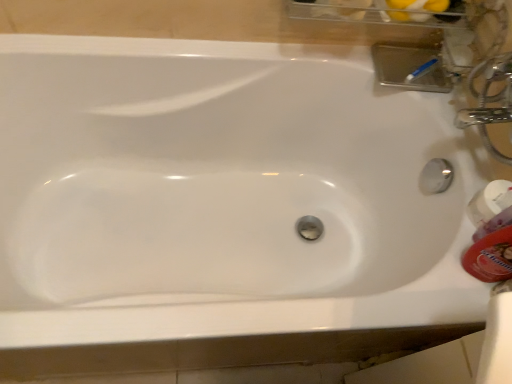
Where is `free space in front of white glossy mouthwash at right, the first mouthwash positioned from the back`? Image resolution: width=512 pixels, height=384 pixels. free space in front of white glossy mouthwash at right, the first mouthwash positioned from the back is located at coordinates (449, 282).